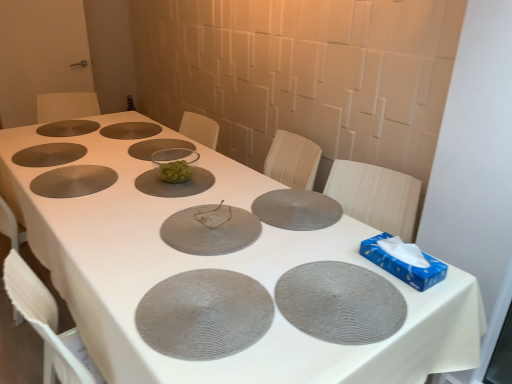
At what (x,y) coordinates should I click in order to perform the action: click on vacant space in between matte gray placemat at left, which appears as the sixth glass plate when viewed from the back, and matte gray placemat at center, acting as the 7th glass plate starting from the back. Please return your answer as a coordinate pair (x, y). The width and height of the screenshot is (512, 384). Looking at the image, I should click on (166, 190).